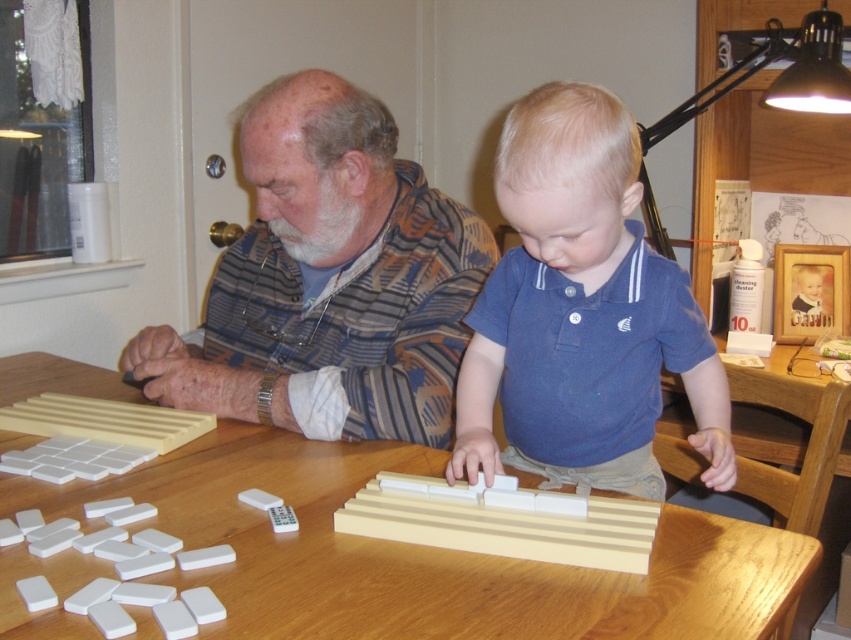
You are a tailor measuring shirts for alterations. You have two shirts in front of you on the table, a striped fabric shirt at center and a blue cotton shirt at center. Which shirt should you measure first if you need to prioritize the one with the greater height?

The striped fabric shirt at center has a greater height compared to the blue cotton shirt at center, so you should measure the striped fabric shirt at center first.

You are a tailor who needs to determine which shirt requires more fabric for alterations. Which shirt between the striped fabric shirt at center and the blue cotton shirt at center requires more fabric?

The striped fabric shirt at center requires more fabric because it is bigger than the blue cotton shirt at center.